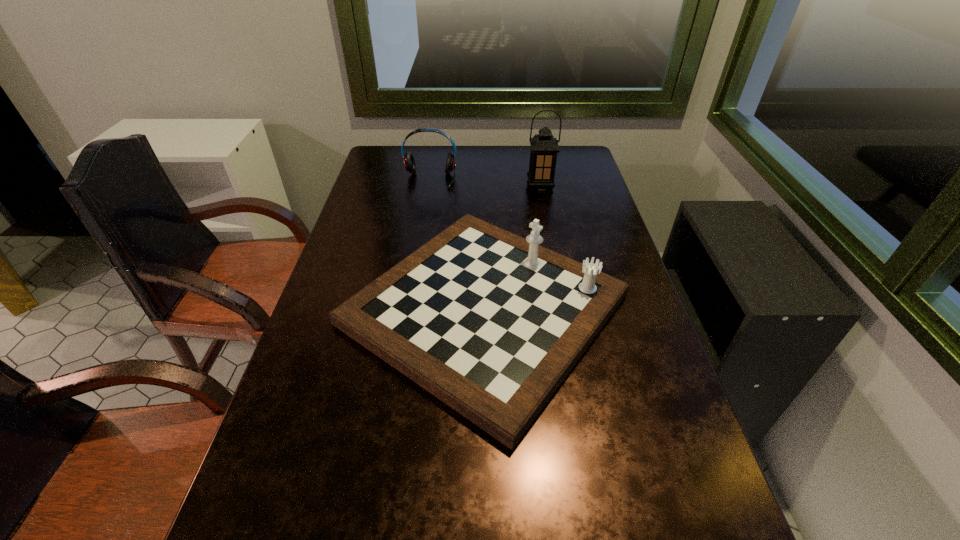
You are a GUI agent. You are given a task and a screenshot of the screen. Output one action in this format:
    pyautogui.click(x=<x>, y=<y>)
    Task: Click on the lantern
    The image size is (960, 540).
    Given the screenshot: What is the action you would take?
    pyautogui.click(x=544, y=147)

Locate an element on the screen. gameboard is located at coordinates (490, 323).

This screenshot has height=540, width=960. In order to click on headset in this screenshot , I will do `click(409, 162)`.

You are a GUI agent. You are given a task and a screenshot of the screen. Output one action in this format:
    pyautogui.click(x=<x>, y=<y>)
    Task: Click on the blank area located 0.320m on the left of the lantern
    The width and height of the screenshot is (960, 540).
    Given the screenshot: What is the action you would take?
    pyautogui.click(x=434, y=187)

Locate an element on the screen. Image resolution: width=960 pixels, height=540 pixels. blank space located 0.260m on the back of the gameboard is located at coordinates (483, 181).

Image resolution: width=960 pixels, height=540 pixels. Identify the location of free space located with the microphone attached to the side of the headset. [x=417, y=258].

Where is `object that is positioned at the far edge`? The width and height of the screenshot is (960, 540). object that is positioned at the far edge is located at coordinates (409, 162).

At what (x,y) coordinates should I click in order to perform the action: click on gameboard located at the left edge. Please return your answer as a coordinate pair (x, y). Looking at the image, I should click on (490, 323).

Where is `headset that is positioned at the left edge`? headset that is positioned at the left edge is located at coordinates (409, 162).

Locate an element on the screen. lantern located at the right edge is located at coordinates (544, 147).